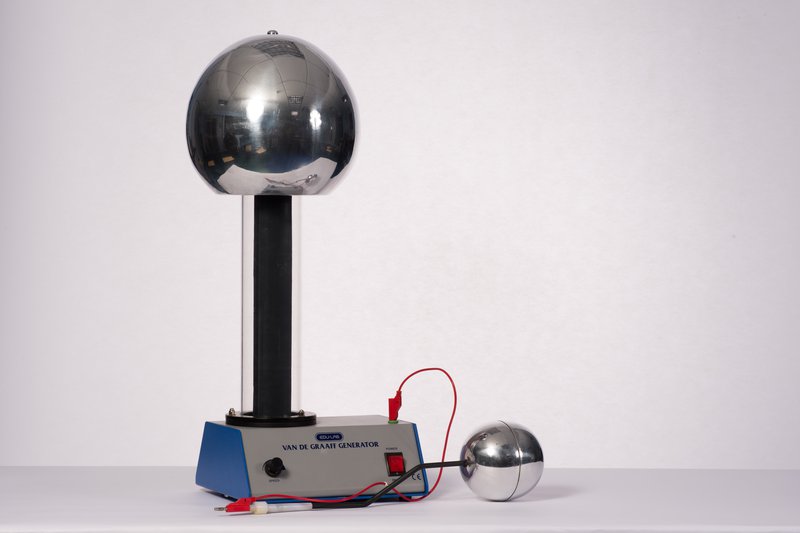
In order to click on counter in this screenshot , I will do 602,496.